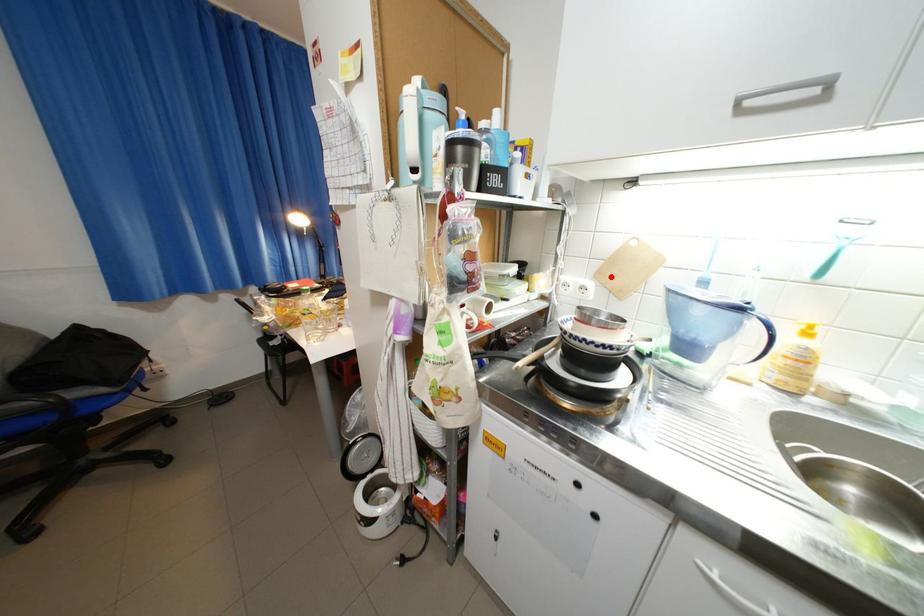
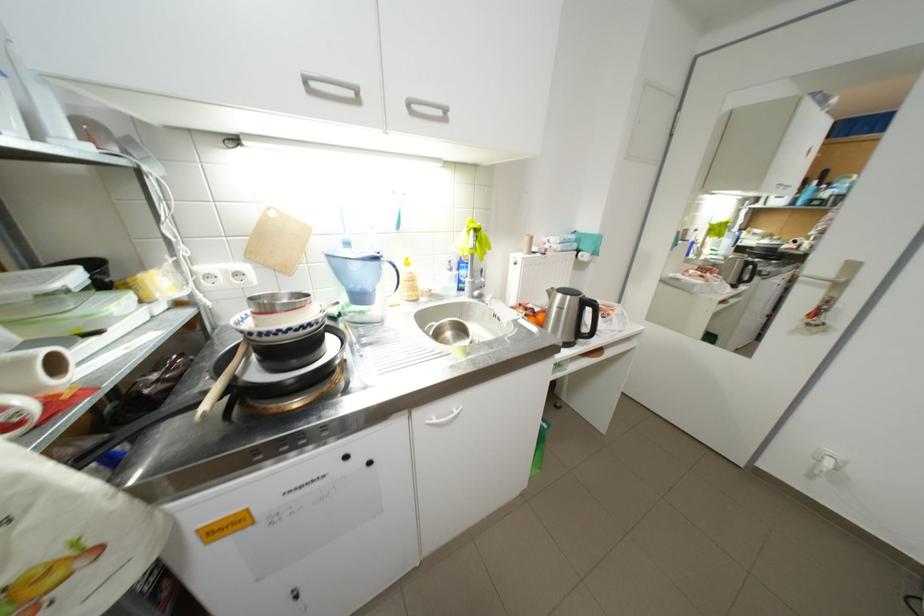
Locate, in the second image, the point that corresponds to the highlighted location in the first image.

(262, 256)